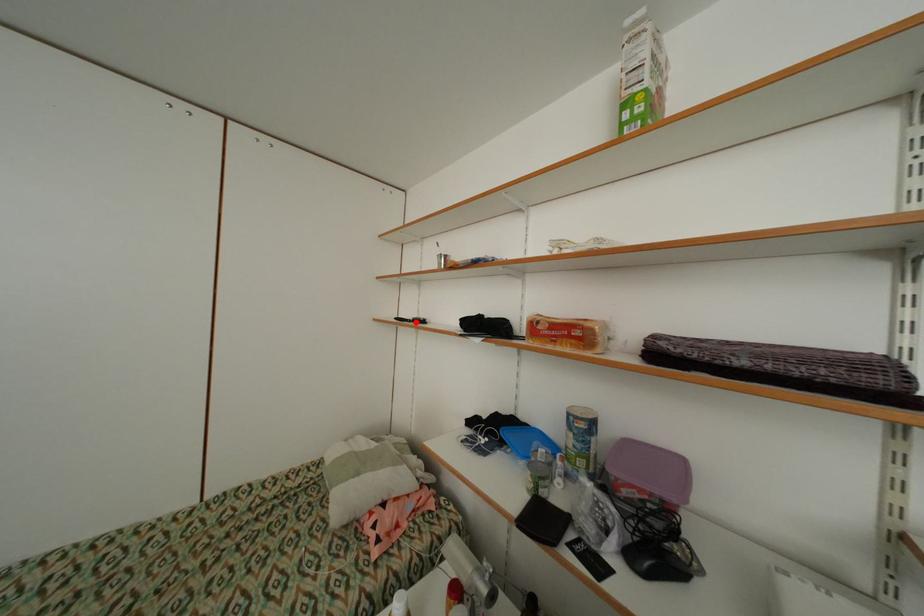
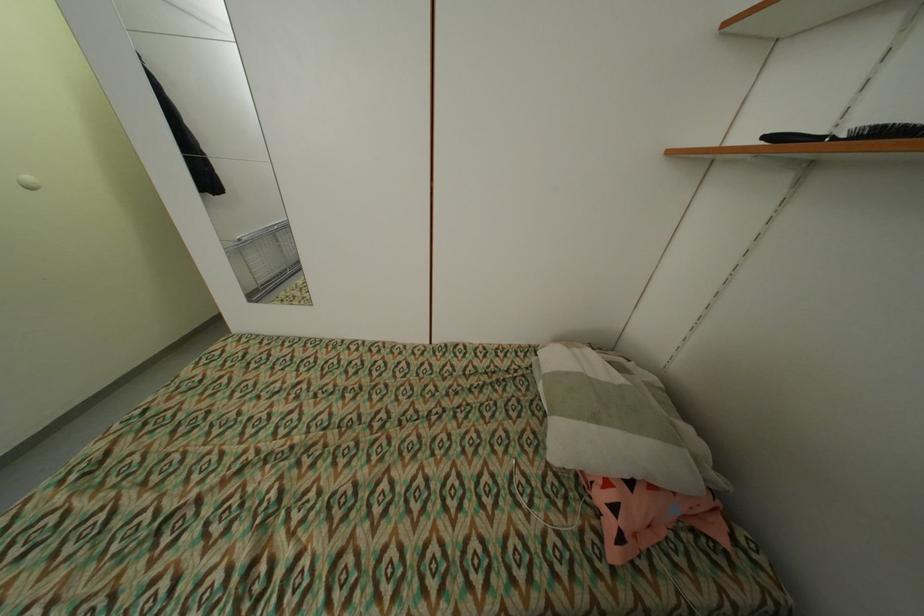
The point at the highlighted location is marked in the first image. Where is the corresponding point in the second image?

(841, 140)